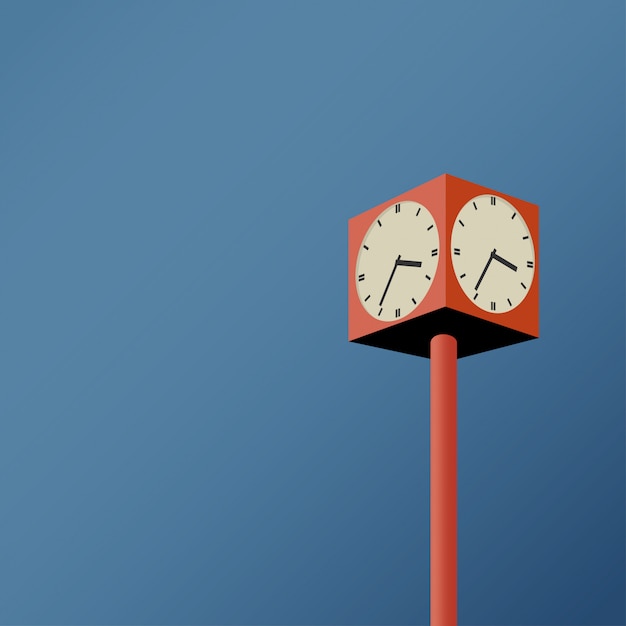
You are a GUI agent. You are given a task and a screenshot of the screen. Output one action in this format:
    pyautogui.click(x=<x>, y=<y>)
    Task: Click on the blank space on right of clock
    The height and width of the screenshot is (626, 626).
    Given the screenshot: What is the action you would take?
    pyautogui.click(x=529, y=434)